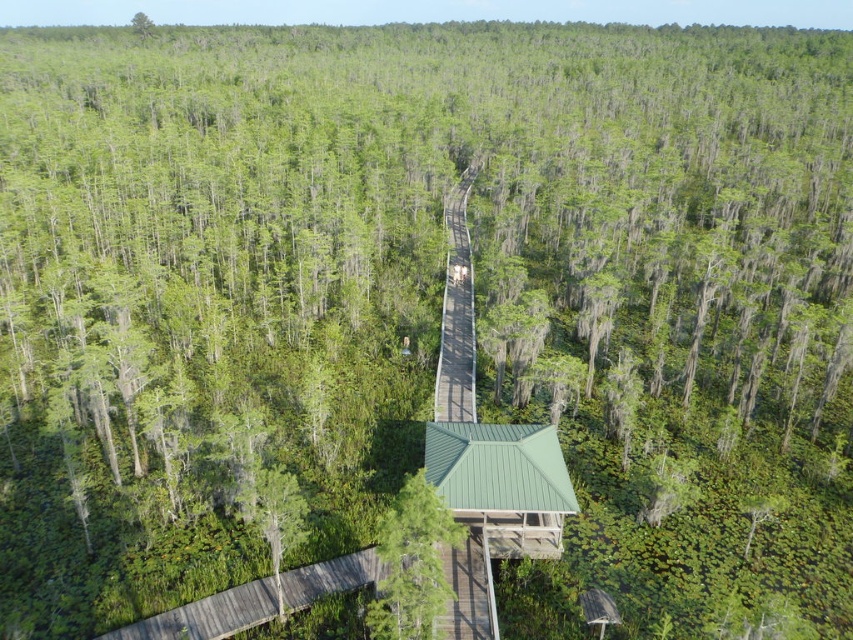
Does brown wooden boardwalk at center appear on the left side of green matte tree at lower left?

In fact, brown wooden boardwalk at center is to the right of green matte tree at lower left.

Does brown wooden boardwalk at center have a smaller size compared to green matte tree at lower left?

Incorrect, brown wooden boardwalk at center is not smaller in size than green matte tree at lower left.

Between point (438, 406) and point (279, 538), which one is positioned behind?

The point (438, 406) is behind.

Locate an element on the screen. This screenshot has height=640, width=853. brown wooden boardwalk at center is located at coordinates (456, 316).

Is point (416, 582) positioned behind point (444, 301)?

No, it is in front of (444, 301).

Between point (383, 611) and point (457, 396), which one is positioned in front?

Positioned in front is point (383, 611).

Identify the location of green matte tree at center. (412, 563).

Is the position of green matte tree at center more distant than that of green matte tree at lower left?

No, it is not.

Does green matte tree at center appear over green matte tree at lower left?

Yes.

Who is more forward, (x=434, y=548) or (x=283, y=540)?

Positioned in front is point (x=434, y=548).

Identify the location of green matte tree at center. This screenshot has height=640, width=853. (412, 563).